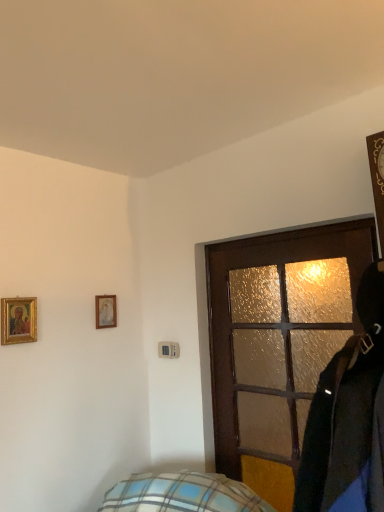
Question: Looking at the image, does matte white picture frame at upper left, the second picture frame from the left, seem bigger or smaller compared to brown textured door at center?

Choices:
 (A) small
 (B) big

Answer: (A)

Question: In terms of height, does matte white picture frame at upper left, the first picture frame when ordered from back to front, look taller or shorter compared to brown textured door at center?

Choices:
 (A) tall
 (B) short

Answer: (B)

Question: Which is farther from the matte white picture frame at upper left, which is the 1th picture frame from right to left?

Choices:
 (A) brown textured door at center
 (B) gold-framed picture at upper left, marked as the second picture frame in a back-to-front arrangement

Answer: (A)

Question: Which is farther from the gold-framed picture at upper left, the first picture frame positioned from the front?

Choices:
 (A) matte white picture frame at upper left, which is the 1th picture frame from right to left
 (B) brown textured door at center

Answer: (B)